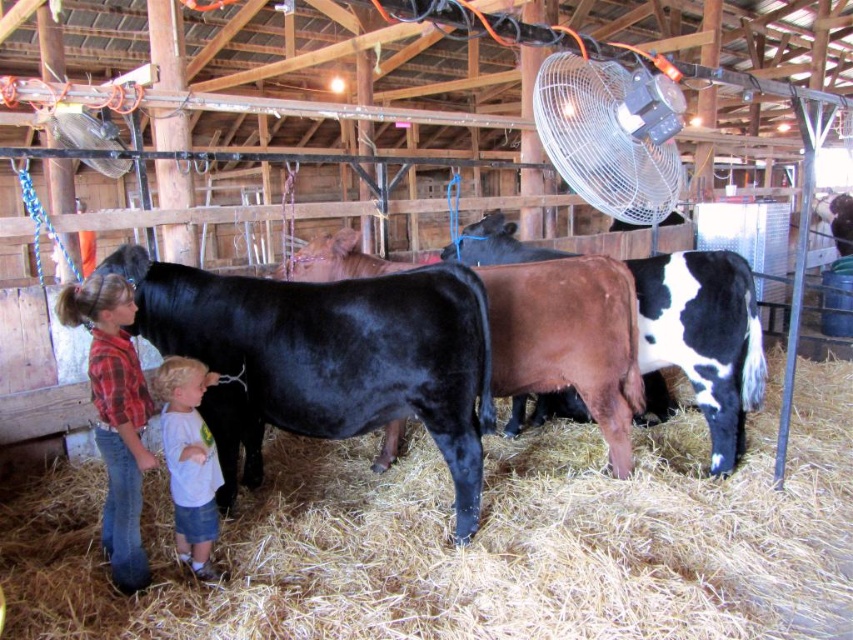
Between point (500, 243) and point (602, 81), which one is positioned behind?

The point (500, 243) is more distant.

How much distance is there between brown smooth cow at center and metallic silver fan at upper center?

brown smooth cow at center is 1.32 meters from metallic silver fan at upper center.

This screenshot has height=640, width=853. Find the location of `brown smooth cow at center`. brown smooth cow at center is located at coordinates (701, 340).

Which is above, metallic silver fan at upper center or denim jeans at lower left?

metallic silver fan at upper center is higher up.

Does point (634, 74) come in front of point (115, 419)?

Yes, point (634, 74) is closer to viewer.

Is point (549, 115) positioned behind point (88, 349)?

No, (549, 115) is in front of (88, 349).

You are a GUI agent. You are given a task and a screenshot of the screen. Output one action in this format:
    pyautogui.click(x=<x>, y=<y>)
    Task: Click on the metallic silver fan at upper center
    
    Given the screenshot: What is the action you would take?
    pyautogui.click(x=611, y=134)

Does black smooth bull at center have a lesser width compared to denim jeans at lower left?

No, black smooth bull at center is not thinner than denim jeans at lower left.

Is point (308, 330) positioned behind point (105, 436)?

Yes, it is behind point (105, 436).

Find the location of a particular element. Image resolution: width=853 pixels, height=640 pixels. black smooth bull at center is located at coordinates (326, 358).